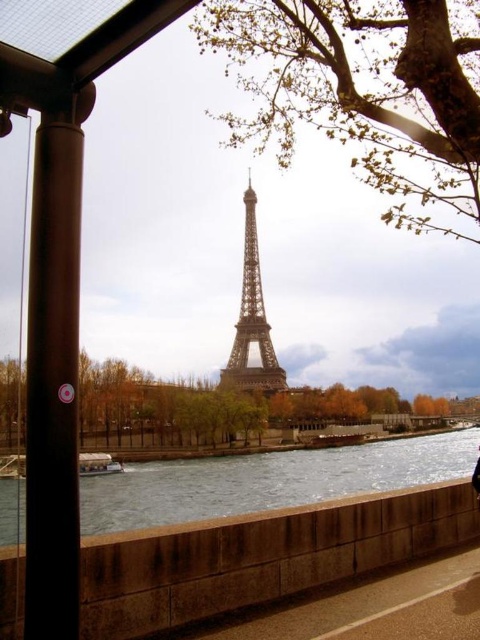
Question: Estimate the real-world distances between objects in this image. Which object is closer to the shiny metallic eiffel tower at center?

Choices:
 (A) black fabric person at lower right
 (B) black polished metal pole at left

Answer: (B)

Question: Considering the real-world distances, which object is closest to the shiny metallic eiffel tower at center?

Choices:
 (A) black fabric person at lower right
 (B) smooth concrete river at center

Answer: (B)

Question: Observing the image, what is the correct spatial positioning of black polished metal pole at left in reference to black fabric person at lower right?

Choices:
 (A) left
 (B) right

Answer: (A)

Question: Does black polished metal pole at left appear over shiny metallic eiffel tower at center?

Choices:
 (A) yes
 (B) no

Answer: (B)

Question: Is smooth concrete river at center below black fabric person at lower right?

Choices:
 (A) no
 (B) yes

Answer: (B)

Question: Which of the following is the farthest from the observer?

Choices:
 (A) shiny metallic eiffel tower at center
 (B) black fabric person at lower right

Answer: (B)